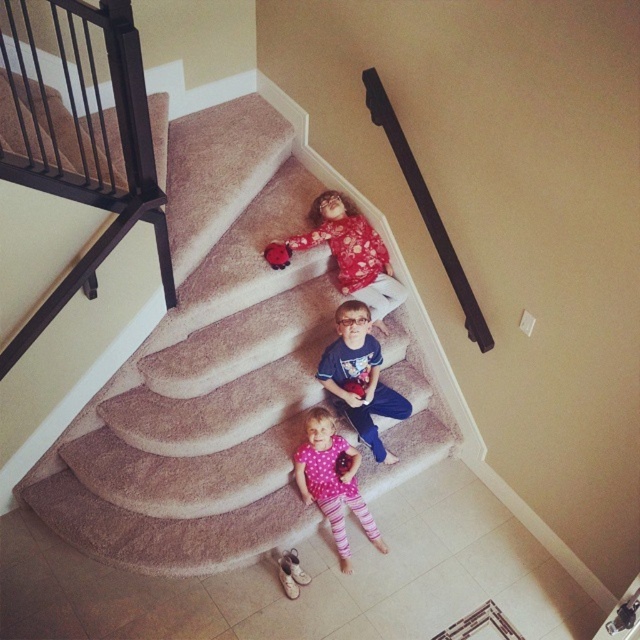
Can you confirm if carpeted stairs at center is positioned below pink polka dot shirt at center?

Incorrect, carpeted stairs at center is not positioned below pink polka dot shirt at center.

From the picture: Is carpeted stairs at center to the right of pink polka dot shirt at center from the viewer's perspective?

Incorrect, carpeted stairs at center is not on the right side of pink polka dot shirt at center.

Which is behind, point (60, 436) or point (320, 474)?

Positioned behind is point (60, 436).

The image size is (640, 640). Find the location of `carpeted stairs at center`. carpeted stairs at center is located at coordinates (204, 380).

Is matte floral dress at center thinner than blue cotton shirt at center?

Incorrect, matte floral dress at center's width is not less than blue cotton shirt at center's.

Does matte floral dress at center have a larger size compared to blue cotton shirt at center?

No.

Who is more forward, (344, 268) or (358, 426)?

Point (358, 426) is more forward.

Locate an element on the screen. matte floral dress at center is located at coordinates (353, 253).

Is blue cotton shirt at center thinner than matte red plush toy at upper center?

No, blue cotton shirt at center is not thinner than matte red plush toy at upper center.

Between point (385, 387) and point (282, 260), which one is positioned behind?

Point (282, 260)

Does point (371, 394) lie in front of point (275, 252)?

Yes, it is in front of point (275, 252).

The image size is (640, 640). I want to click on blue cotton shirt at center, so click(358, 376).